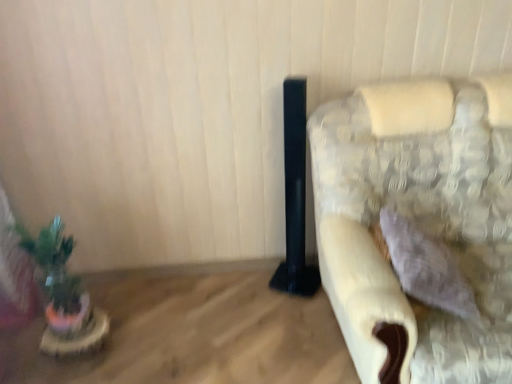
Question: Is point [31, 240] positioned closer to the camera than point [506, 200]?

Choices:
 (A) farther
 (B) closer

Answer: (B)

Question: Is green matte plant at left situated inside fluffy fabric couch at right or outside?

Choices:
 (A) inside
 (B) outside

Answer: (B)

Question: Considering the real-world distances, which object is closest to the wooden table at lower left?

Choices:
 (A) green matte plant at left
 (B) fluffy fabric couch at right

Answer: (A)

Question: Based on their relative distances, which object is farther from the fluffy fabric couch at right?

Choices:
 (A) green matte plant at left
 (B) wooden table at lower left

Answer: (A)